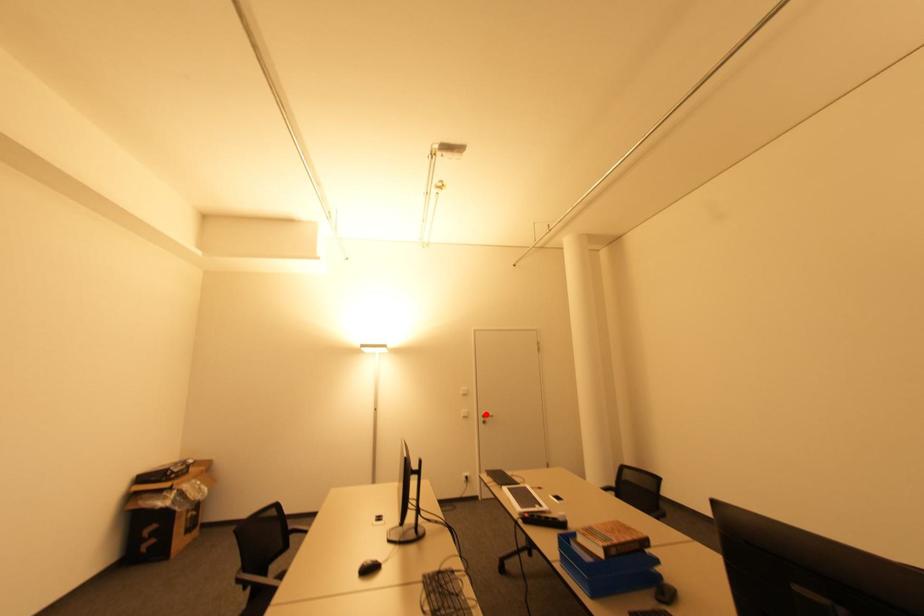
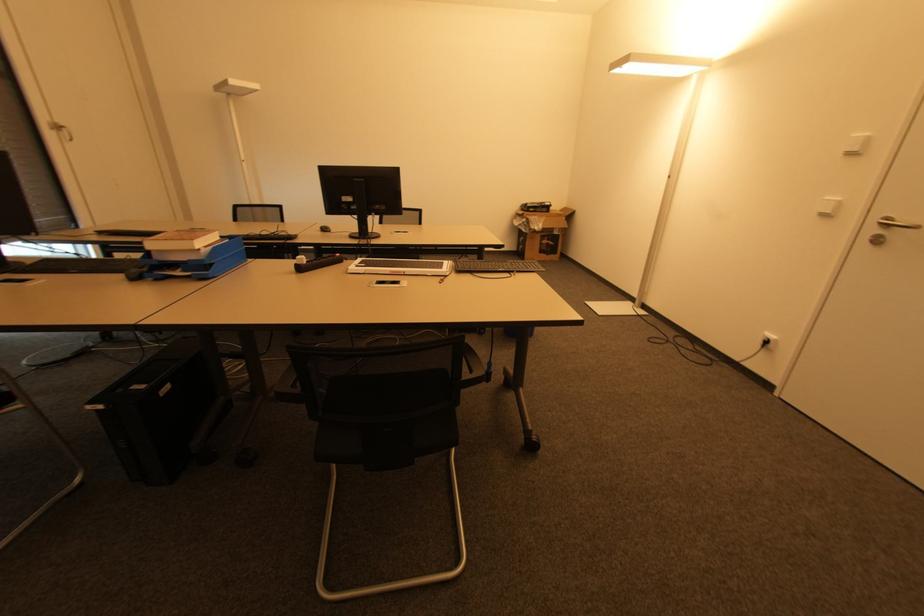
Question: I am providing you with two images of the same scene from different viewpoints. A red point is shown in image1. For the corresponding object point in image2, is it positioned nearer or farther from the camera?

Choices:
 (A) Nearer
 (B) Farther

Answer: (A)